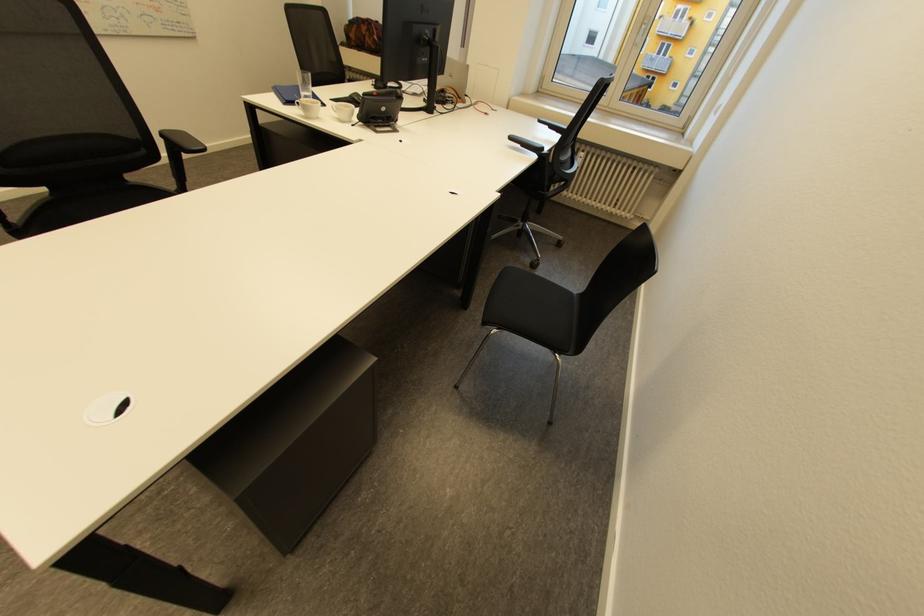
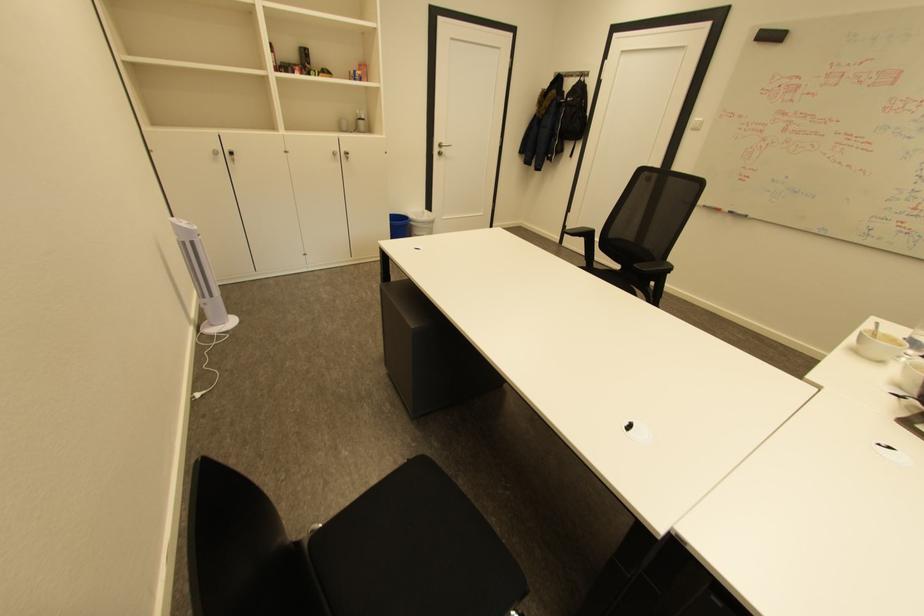
Find the pixel in the second image that matches pixel 348 122 in the first image.

(906, 386)